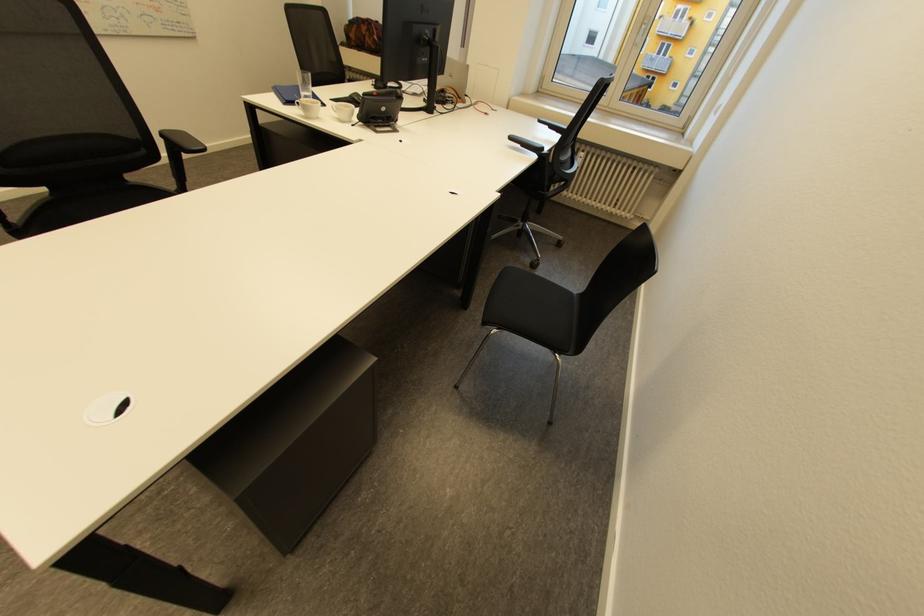
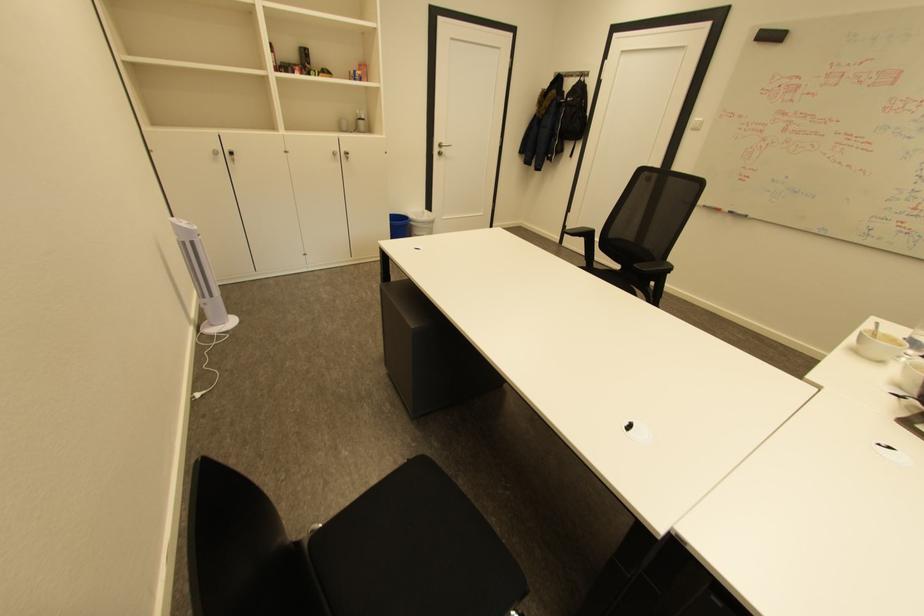
Find the pixel in the second image that matches pixel 348 122 in the first image.

(906, 386)